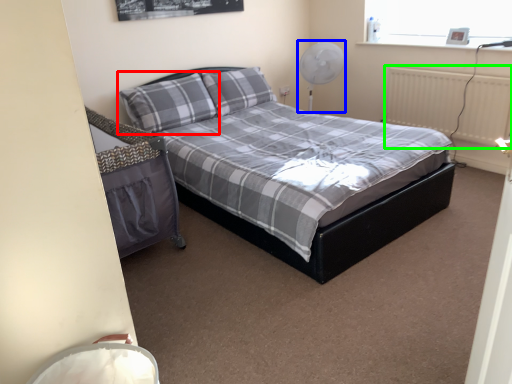
Question: Estimate the real-world distances between objects in this image. Which object is farther from pillow (highlighted by a red box), fan (highlighted by a blue box) or radiator (highlighted by a green box)?

Choices:
 (A) fan
 (B) radiator

Answer: (B)